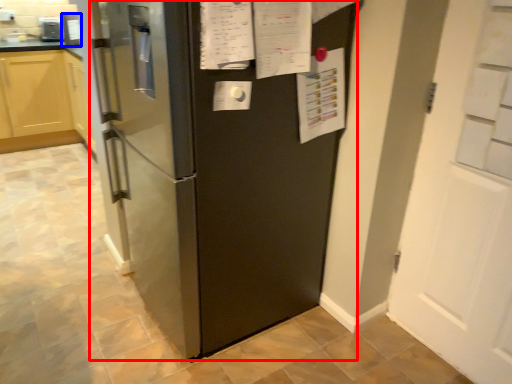
Question: Which object is closer to the camera taking this photo, refrigerator (highlighted by a red box) or appliance (highlighted by a blue box)?

Choices:
 (A) refrigerator
 (B) appliance

Answer: (A)